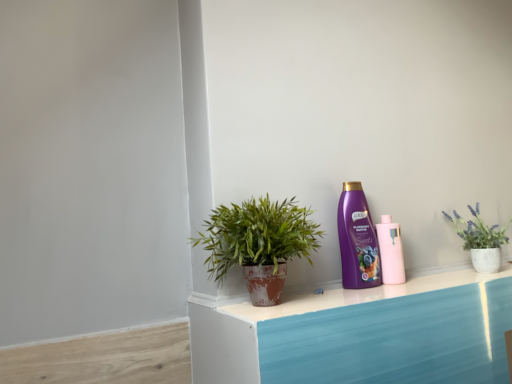
Image resolution: width=512 pixels, height=384 pixels. What are the coordinates of `terracotta pot plant at center` in the screenshot? It's located at (259, 243).

How much space does purple plastic bottle at center-right, arranged as the 1th bottle when viewed from the left, occupy horizontally?

The width of purple plastic bottle at center-right, arranged as the 1th bottle when viewed from the left, is 2.68 inches.

Describe the element at coordinates (391, 251) in the screenshot. I see `pink matte bottle at center-right, which appears as the 1th bottle when viewed from the right` at that location.

You are a GUI agent. You are given a task and a screenshot of the screen. Output one action in this format:
    pyautogui.click(x=<x>, y=<y>)
    Task: Click on the terracotta pot plant at center
    The height and width of the screenshot is (384, 512).
    Given the screenshot: What is the action you would take?
    pyautogui.click(x=259, y=243)

Is pink matte bottle at center-right, which appears as the second bottle when viewed from the left, touching terracotta pot plant at center?

No, pink matte bottle at center-right, which appears as the second bottle when viewed from the left, is not with terracotta pot plant at center.

Which object is further away from the camera, pink matte bottle at center-right, which appears as the 1th bottle when viewed from the right, or terracotta pot plant at center?

pink matte bottle at center-right, which appears as the 1th bottle when viewed from the right, is more distant.

Considering the relative sizes of pink matte bottle at center-right, which appears as the second bottle when viewed from the left, and terracotta pot plant at center in the image provided, is pink matte bottle at center-right, which appears as the second bottle when viewed from the left, bigger than terracotta pot plant at center?

No.

Who is shorter, pink matte bottle at center-right, which appears as the 1th bottle when viewed from the right, or terracotta pot plant at center?

pink matte bottle at center-right, which appears as the 1th bottle when viewed from the right, is shorter.

Consider the image. Are purple plastic bottle at center-right, arranged as the 1th bottle when viewed from the left, and pink matte bottle at center-right, which appears as the second bottle when viewed from the left, located far from each other?

No, there isn't a large distance between purple plastic bottle at center-right, arranged as the 1th bottle when viewed from the left, and pink matte bottle at center-right, which appears as the second bottle when viewed from the left.

From the image's perspective, which is below, purple plastic bottle at center-right, arranged as the 1th bottle when viewed from the left, or pink matte bottle at center-right, which appears as the second bottle when viewed from the left?

pink matte bottle at center-right, which appears as the second bottle when viewed from the left, appears lower in the image.

How far apart are purple plastic bottle at center-right, arranged as the 2th bottle when viewed from the right, and pink matte bottle at center-right, which appears as the 1th bottle when viewed from the right?

They are 2.49 inches apart.

From a real-world perspective, is terracotta pot plant at center beneath pink matte bottle at center-right, which appears as the 1th bottle when viewed from the right?

Actually, terracotta pot plant at center is physically above pink matte bottle at center-right, which appears as the 1th bottle when viewed from the right, in the real world.

Which object is further away from the camera taking this photo, terracotta pot plant at center or pink matte bottle at center-right, which appears as the 1th bottle when viewed from the right?

pink matte bottle at center-right, which appears as the 1th bottle when viewed from the right.

Is there a large distance between terracotta pot plant at center and pink matte bottle at center-right, which appears as the second bottle when viewed from the left?

No, terracotta pot plant at center is not far away from pink matte bottle at center-right, which appears as the second bottle when viewed from the left.

From the image's perspective, which object appears higher, terracotta pot plant at center or pink matte bottle at center-right, which appears as the second bottle when viewed from the left?

terracotta pot plant at center is shown above in the image.

Considering the sizes of objects pink matte bottle at center-right, which appears as the second bottle when viewed from the left, and purple plastic bottle at center-right, arranged as the 1th bottle when viewed from the left, in the image provided, who is taller, pink matte bottle at center-right, which appears as the second bottle when viewed from the left, or purple plastic bottle at center-right, arranged as the 1th bottle when viewed from the left,?

With more height is purple plastic bottle at center-right, arranged as the 1th bottle when viewed from the left.

Is point (384, 259) farther from viewer compared to point (362, 217)?

Yes, point (384, 259) is farther from viewer.

Would you say pink matte bottle at center-right, which appears as the 1th bottle when viewed from the right, contains purple plastic bottle at center-right, arranged as the 2th bottle when viewed from the right?

Actually, purple plastic bottle at center-right, arranged as the 2th bottle when viewed from the right, is outside pink matte bottle at center-right, which appears as the 1th bottle when viewed from the right.

You are a GUI agent. You are given a task and a screenshot of the screen. Output one action in this format:
    pyautogui.click(x=<x>, y=<y>)
    Task: Click on the houseplant located above the purple plastic bottle at center-right, arranged as the 1th bottle when viewed from the left (from the image's perspective)
    
    Given the screenshot: What is the action you would take?
    pyautogui.click(x=259, y=243)

From a real-world perspective, is purple plastic bottle at center-right, arranged as the 1th bottle when viewed from the left, positioned under terracotta pot plant at center based on gravity?

No, from a real-world perspective, purple plastic bottle at center-right, arranged as the 1th bottle when viewed from the left, is not below terracotta pot plant at center.

Considering the relative positions of purple plastic bottle at center-right, arranged as the 2th bottle when viewed from the right, and terracotta pot plant at center in the image provided, is purple plastic bottle at center-right, arranged as the 2th bottle when viewed from the right, to the left of terracotta pot plant at center from the viewer's perspective?

In fact, purple plastic bottle at center-right, arranged as the 2th bottle when viewed from the right, is to the right of terracotta pot plant at center.

Locate an element on the screen. Image resolution: width=512 pixels, height=384 pixels. houseplant that is under the purple plastic bottle at center-right, arranged as the 1th bottle when viewed from the left (from a real-world perspective) is located at coordinates (259, 243).

Is terracotta pot plant at center facing away from purple plastic bottle at center-right, arranged as the 2th bottle when viewed from the right?

No, terracotta pot plant at center is not facing away from purple plastic bottle at center-right, arranged as the 2th bottle when viewed from the right.

Based on their sizes in the image, would you say terracotta pot plant at center is bigger or smaller than purple plastic bottle at center-right, arranged as the 2th bottle when viewed from the right?

Considering their sizes, terracotta pot plant at center takes up more space than purple plastic bottle at center-right, arranged as the 2th bottle when viewed from the right.

At what (x,y) coordinates should I click in order to perform the action: click on bottle below the terracotta pot plant at center (from a real-world perspective). Please return your answer as a coordinate pair (x, y). Image resolution: width=512 pixels, height=384 pixels. Looking at the image, I should click on (391, 251).

You are a GUI agent. You are given a task and a screenshot of the screen. Output one action in this format:
    pyautogui.click(x=<x>, y=<y>)
    Task: Click on the bottle below the purple plastic bottle at center-right, arranged as the 2th bottle when viewed from the right (from the image's perspective)
    The image size is (512, 384).
    Given the screenshot: What is the action you would take?
    pyautogui.click(x=391, y=251)

Looking at this image, from the image, which object appears to be farther from terracotta pot plant at center, pink matte bottle at center-right, which appears as the 1th bottle when viewed from the right, or purple plastic bottle at center-right, arranged as the 2th bottle when viewed from the right?

pink matte bottle at center-right, which appears as the 1th bottle when viewed from the right, is further to terracotta pot plant at center.

Which object lies nearer to the anchor point pink matte bottle at center-right, which appears as the second bottle when viewed from the left, purple plastic bottle at center-right, arranged as the 2th bottle when viewed from the right, or terracotta pot plant at center?

purple plastic bottle at center-right, arranged as the 2th bottle when viewed from the right, is closer to pink matte bottle at center-right, which appears as the second bottle when viewed from the left.

Looking at this image, estimate the real-world distances between objects in this image. Which object is further from terracotta pot plant at center, purple plastic bottle at center-right, arranged as the 1th bottle when viewed from the left, or pink matte bottle at center-right, which appears as the second bottle when viewed from the left?

pink matte bottle at center-right, which appears as the second bottle when viewed from the left, is positioned further to the anchor terracotta pot plant at center.

Considering their positions, is pink matte bottle at center-right, which appears as the second bottle when viewed from the left, positioned closer to purple plastic bottle at center-right, arranged as the 1th bottle when viewed from the left, than terracotta pot plant at center?

The object closer to purple plastic bottle at center-right, arranged as the 1th bottle when viewed from the left, is pink matte bottle at center-right, which appears as the second bottle when viewed from the left.

Which object lies nearer to the anchor point pink matte bottle at center-right, which appears as the 1th bottle when viewed from the right, terracotta pot plant at center or purple plastic bottle at center-right, arranged as the 2th bottle when viewed from the right?

purple plastic bottle at center-right, arranged as the 2th bottle when viewed from the right, is positioned closer to the anchor pink matte bottle at center-right, which appears as the 1th bottle when viewed from the right.

Which object lies further to the anchor point purple plastic bottle at center-right, arranged as the 1th bottle when viewed from the left, terracotta pot plant at center or pink matte bottle at center-right, which appears as the 1th bottle when viewed from the right?

terracotta pot plant at center is positioned further to the anchor purple plastic bottle at center-right, arranged as the 1th bottle when viewed from the left.

At what (x,y) coordinates should I click in order to perform the action: click on bottle between terracotta pot plant at center and pink matte bottle at center-right, which appears as the second bottle when viewed from the left, in the front-back direction. Please return your answer as a coordinate pair (x, y). Looking at the image, I should click on (357, 240).